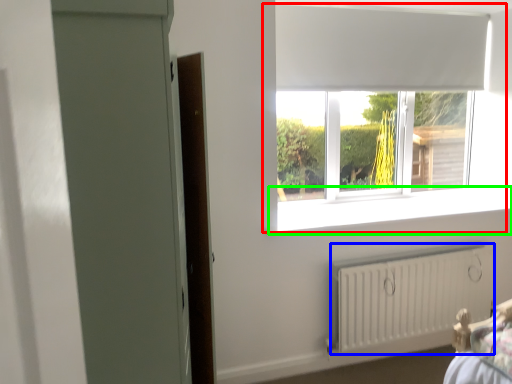
Question: Estimate the real-world distances between objects in this image. Which object is farther from window (highlighted by a red box), radiator (highlighted by a blue box) or window sill (highlighted by a green box)?

Choices:
 (A) radiator
 (B) window sill

Answer: (A)